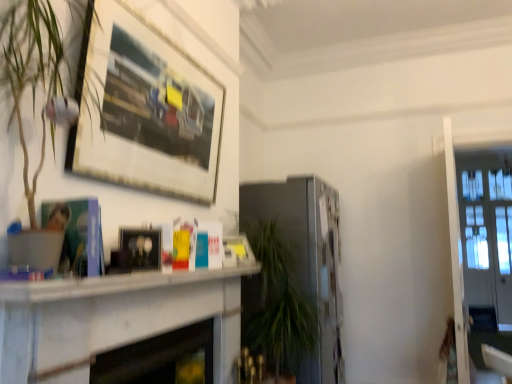
What is the approximate width of white marble fireplace at center, arranged as the 1th fireplace when viewed from the front?

The width of white marble fireplace at center, arranged as the 1th fireplace when viewed from the front, is 7.11 inches.

Locate an element on the screen. This screenshot has height=384, width=512. wooden picture frame at upper left, which is the 2th picture frame in bottom-to-top order is located at coordinates (146, 109).

How many degrees apart are the facing directions of clear glass door at right and wooden picture frame at upper left, which appears as the 1th picture frame when viewed from the top?

clear glass door at right and wooden picture frame at upper left, which appears as the 1th picture frame when viewed from the top, are facing 89.6 degrees away from each other.

Would you say wooden picture frame at upper left, which appears as the 1th picture frame when viewed from the top, is part of clear glass door at right's contents?

No.

From the image's perspective, which is above, clear glass door at right or wooden picture frame at upper left, which appears as the 1th picture frame when viewed from the top?

From the image's view, wooden picture frame at upper left, which appears as the 1th picture frame when viewed from the top, is above.

Is clear glass door at right in contact with wooden picture frame at upper left, which appears as the 1th picture frame when viewed from the top?

No, clear glass door at right is not touching wooden picture frame at upper left, which appears as the 1th picture frame when viewed from the top.

Considering the relative sizes of satin silver fireplace at center, the 2th fireplace in the front-to-back sequence, and wooden picture frame at upper left, which is the 2th picture frame in bottom-to-top order, in the image provided, is satin silver fireplace at center, the 2th fireplace in the front-to-back sequence, shorter than wooden picture frame at upper left, which is the 2th picture frame in bottom-to-top order,?

Incorrect, the height of satin silver fireplace at center, the 2th fireplace in the front-to-back sequence, does not fall short of that of wooden picture frame at upper left, which is the 2th picture frame in bottom-to-top order.

Are satin silver fireplace at center, the first fireplace in the right-to-left sequence, and wooden picture frame at upper left, which appears as the 1th picture frame when viewed from the top, far apart?

satin silver fireplace at center, the first fireplace in the right-to-left sequence, is positioned a significant distance from wooden picture frame at upper left, which appears as the 1th picture frame when viewed from the top.

Considering the sizes of objects satin silver fireplace at center, marked as the second fireplace in a left-to-right arrangement, and wooden picture frame at upper left, which is the 2th picture frame in bottom-to-top order, in the image provided, who is thinner, satin silver fireplace at center, marked as the second fireplace in a left-to-right arrangement, or wooden picture frame at upper left, which is the 2th picture frame in bottom-to-top order,?

With smaller width is wooden picture frame at upper left, which is the 2th picture frame in bottom-to-top order.

Identify the location of fireplace on the right of wooden picture frame at upper left, which is the 2th picture frame in bottom-to-top order. This screenshot has height=384, width=512. (306, 258).

Locate an element on the screen. This screenshot has height=384, width=512. the 1st fireplace behind the white marble fireplace at center is located at coordinates (156, 357).

Which of these two, white marble fireplace at center, the first fireplace in the left-to-right sequence, or white marble fireplace at center, is bigger?

Bigger between the two is white marble fireplace at center.

Does point (184, 328) come closer to viewer compared to point (89, 311)?

No.

Can white marble fireplace at center be found inside white marble fireplace at center, placed as the 2th fireplace when sorted from right to left?

No.

From the image's perspective, is wooden picture frame at upper left, which is the 2th picture frame in bottom-to-top order, located beneath satin silver fireplace at center, the 2th fireplace in the front-to-back sequence?

No.

Starting from the satin silver fireplace at center, the 2th fireplace in the front-to-back sequence, which picture frame is the 2nd one in front? Please provide its 2D coordinates.

[(146, 109)]

Is wooden picture frame at upper left, which appears as the 1th picture frame when viewed from the top, closer to the viewer compared to satin silver fireplace at center, the first fireplace viewed from the back?

Yes, wooden picture frame at upper left, which appears as the 1th picture frame when viewed from the top, is closer to the camera.

Measure the distance between wooden picture frame at upper left, which appears as the 1th picture frame when viewed from the top, and satin silver fireplace at center, the first fireplace viewed from the back.

A distance of 3.33 feet exists between wooden picture frame at upper left, which appears as the 1th picture frame when viewed from the top, and satin silver fireplace at center, the first fireplace viewed from the back.

Is wooden picture frame at upper left, which appears as the 1th picture frame when viewed from the top, inside or outside of white marble fireplace at center?

wooden picture frame at upper left, which appears as the 1th picture frame when viewed from the top, is located beyond the bounds of white marble fireplace at center.

Is wooden picture frame at upper left, which appears as the 1th picture frame when viewed from the top, not near white marble fireplace at center?

No, wooden picture frame at upper left, which appears as the 1th picture frame when viewed from the top, is not far away from white marble fireplace at center.

Which is closer, [113,41] or [83,371]?

Point [113,41] is farther from the camera than point [83,371].

Does wooden picture frame at upper left, which appears as the 1th picture frame when viewed from the top, appear on the left side of white marble fireplace at center?

Correct, you'll find wooden picture frame at upper left, which appears as the 1th picture frame when viewed from the top, to the left of white marble fireplace at center.

Considering the positions of objects white marble fireplace at center and satin silver fireplace at center, the 2th fireplace in the front-to-back sequence, in the image provided, who is in front, white marble fireplace at center or satin silver fireplace at center, the 2th fireplace in the front-to-back sequence,?

white marble fireplace at center is in front.

Based on the photo, from a real-world perspective, which object rests below the other?

white marble fireplace at center, from a real-world perspective.

From the image's perspective, is white marble fireplace at center under satin silver fireplace at center, the first fireplace viewed from the back?

No.

Is white marble fireplace at center oriented towards satin silver fireplace at center, the first fireplace viewed from the back?

No, white marble fireplace at center is not turned towards satin silver fireplace at center, the first fireplace viewed from the back.

Looking at this image, from their relative heights in the image, would you say white marble fireplace at center is taller or shorter than wooden picture frame at upper left, which appears as the 1th picture frame when viewed from the top?

In the image, white marble fireplace at center appears to be shorter than wooden picture frame at upper left, which appears as the 1th picture frame when viewed from the top.

Does white marble fireplace at center have a larger size compared to wooden picture frame at upper left, which appears as the 1th picture frame when viewed from the top?

No.

Does white marble fireplace at center appear on the left side of wooden picture frame at upper left, which is the 2th picture frame in bottom-to-top order?

No.

How different are the orientations of white marble fireplace at center and wooden picture frame at upper left, which appears as the 1th picture frame when viewed from the top, in degrees?

white marble fireplace at center and wooden picture frame at upper left, which appears as the 1th picture frame when viewed from the top, are facing 0.193 degrees away from each other.

Locate an element on the screen. glass door below the wooden picture frame at upper left, which appears as the 1th picture frame when viewed from the top (from the image's perspective) is located at coordinates (456, 254).

From a real-world perspective, count 1st fireplaces downward from the wooden picture frame at upper left, which appears as the 1th picture frame when viewed from the top, and point to it. Please provide its 2D coordinates.

[(306, 258)]

Looking at this image, which object lies nearer to the anchor point white marble fireplace at center, arranged as the 1th fireplace when viewed from the front, matte black picture frame at center, placed as the second picture frame when sorted from top to bottom, or clear glass door at right?

matte black picture frame at center, placed as the second picture frame when sorted from top to bottom, is positioned closer to the anchor white marble fireplace at center, arranged as the 1th fireplace when viewed from the front.

Based on the photo, which object lies further to the anchor point satin silver fireplace at center, the 2th fireplace in the front-to-back sequence, clear glass door at right or white marble fireplace at center, positioned as the 2th fireplace in back-to-front order?

white marble fireplace at center, positioned as the 2th fireplace in back-to-front order, lies further to satin silver fireplace at center, the 2th fireplace in the front-to-back sequence, than the other object.

Based on their spatial positions, is wooden picture frame at upper left, which is the 2th picture frame in bottom-to-top order, or white marble fireplace at center, placed as the 2th fireplace when sorted from right to left, closer to white marble fireplace at center?

→ Among the two, white marble fireplace at center, placed as the 2th fireplace when sorted from right to left, is located nearer to white marble fireplace at center.

Which object lies further to the anchor point white marble fireplace at center, placed as the 2th fireplace when sorted from right to left, clear glass door at right or satin silver fireplace at center, the first fireplace in the right-to-left sequence?

clear glass door at right is further to white marble fireplace at center, placed as the 2th fireplace when sorted from right to left.

Considering their positions, is white marble fireplace at center positioned further to white marble fireplace at center, placed as the 2th fireplace when sorted from right to left, than clear glass door at right?

Among the two, clear glass door at right is located further to white marble fireplace at center, placed as the 2th fireplace when sorted from right to left.

Looking at the image, which one is located closer to matte black picture frame at center, placed as the second picture frame when sorted from top to bottom, white marble fireplace at center or clear glass door at right?

white marble fireplace at center lies closer to matte black picture frame at center, placed as the second picture frame when sorted from top to bottom, than the other object.

Considering their positions, is white marble fireplace at center positioned closer to satin silver fireplace at center, the 2th fireplace in the front-to-back sequence, than clear glass door at right?

white marble fireplace at center.

Based on their spatial positions, is clear glass door at right or white marble fireplace at center further from satin silver fireplace at center, the first fireplace in the right-to-left sequence?

Among the two, clear glass door at right is located further to satin silver fireplace at center, the first fireplace in the right-to-left sequence.

This screenshot has height=384, width=512. Find the location of `table between matte black picture frame at center, placed as the second picture frame when sorted from top to bottom, and white marble fireplace at center, arranged as the 1th fireplace when viewed from the front, from top to bottom`. table between matte black picture frame at center, placed as the second picture frame when sorted from top to bottom, and white marble fireplace at center, arranged as the 1th fireplace when viewed from the front, from top to bottom is located at coordinates coord(112,319).

Image resolution: width=512 pixels, height=384 pixels. What are the coordinates of `fireplace between matte black picture frame at center, which is counted as the first picture frame, starting from the bottom, and clear glass door at right` in the screenshot? It's located at click(306, 258).

Identify the location of picture frame between wooden picture frame at upper left, which is the 2th picture frame in bottom-to-top order, and white marble fireplace at center, positioned as the 2th fireplace in back-to-front order, from top to bottom. This screenshot has width=512, height=384. (141, 247).

In order to click on table between matte black picture frame at center, placed as the second picture frame when sorted from top to bottom, and clear glass door at right, in the horizontal direction in this screenshot , I will do `click(112, 319)`.